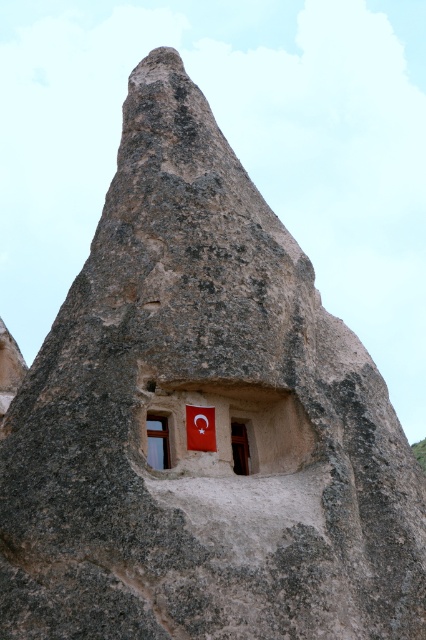
Question: Which point is farther from the camera taking this photo?

Choices:
 (A) (154, 436)
 (B) (201, 422)
 (C) (245, 442)

Answer: (C)

Question: Which object appears closest to the camera in this image?

Choices:
 (A) red fabric flag at center
 (B) matte wood window at center
 (C) matte red flag at center

Answer: (B)

Question: Which object is positioned farthest from the matte red flag at center?

Choices:
 (A) matte wood window at center
 (B) red fabric flag at center

Answer: (A)

Question: Where is matte wood window at center located in relation to matte red flag at center in the image?

Choices:
 (A) above
 (B) below

Answer: (A)

Question: Is red fabric flag at center to the right of matte wood window at center from the viewer's perspective?

Choices:
 (A) yes
 (B) no

Answer: (A)

Question: Observing the image, what is the correct spatial positioning of red fabric flag at center in reference to matte wood window at center?

Choices:
 (A) above
 (B) below

Answer: (A)